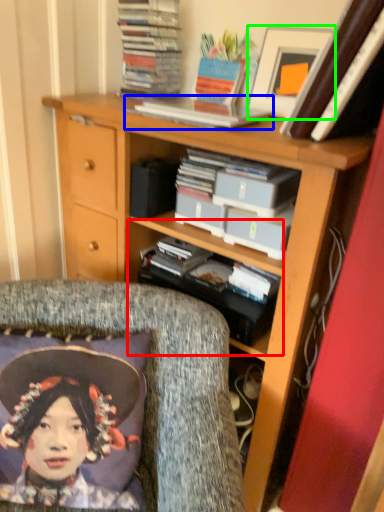
Question: Based on their relative distances, which object is farther from shelf (highlighted by a red box)? Choose from book (highlighted by a blue box) and picture frame (highlighted by a green box).

Choices:
 (A) book
 (B) picture frame

Answer: (B)